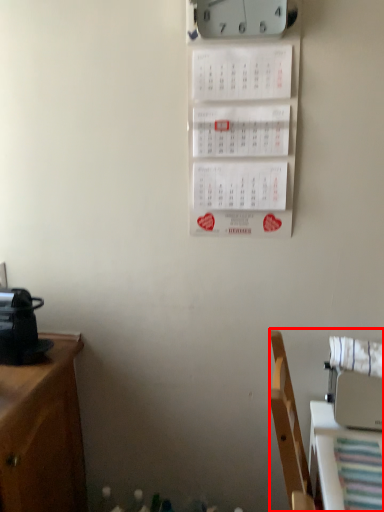
Question: In this image, where is furniture (annotated by the red box) located relative to clock?

Choices:
 (A) right
 (B) left

Answer: (A)